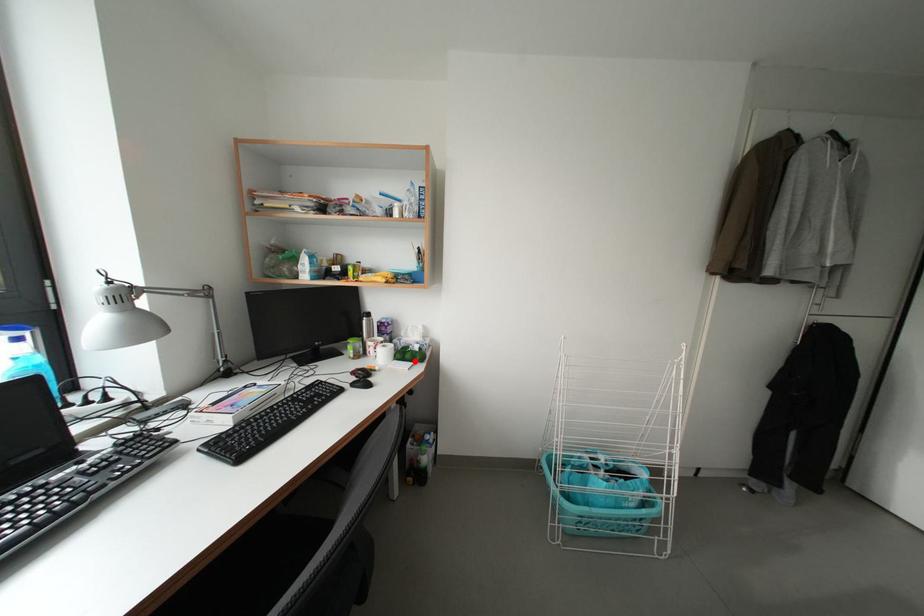
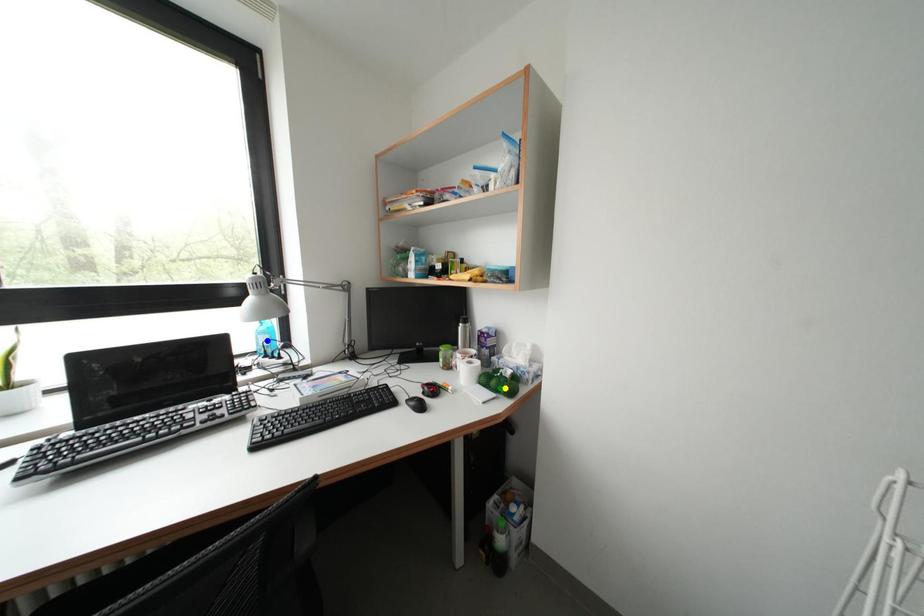
Question: I am providing you with two images of the same scene from different viewpoints. A red point is marked on the first image. You are given multiple points on the second image. Which point in image 2 represents the same 3d spot as the red point in image 1?

Choices:
 (A) blue point
 (B) green point
 (C) yellow point

Answer: (B)